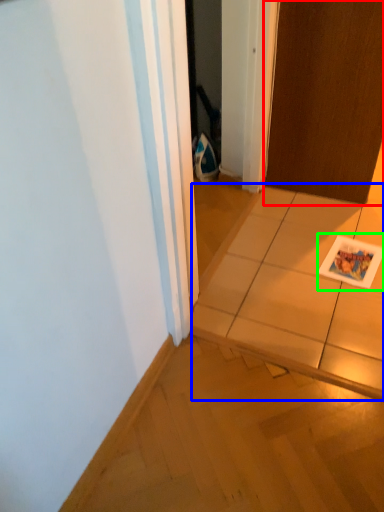
Question: Which object is positioned closest to door (highlighted by a red box)? Select from tile (highlighted by a blue box) and postcard (highlighted by a green box).

Choices:
 (A) tile
 (B) postcard

Answer: (B)